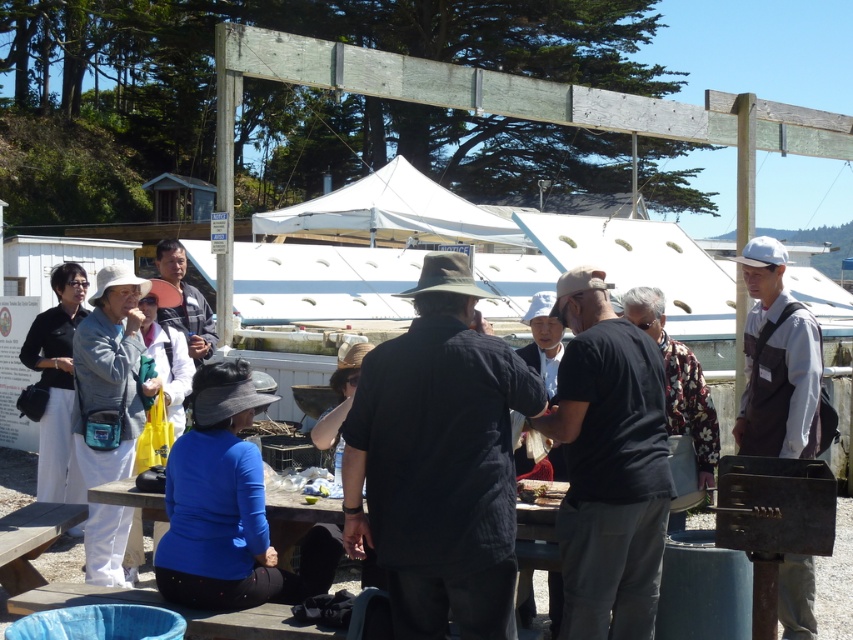
The height and width of the screenshot is (640, 853). Describe the element at coordinates (439, 460) in the screenshot. I see `dark brown fabric hat at center` at that location.

Does dark brown fabric hat at center have a greater height compared to matte black jacket at center?

Yes.

Is point (471, 340) behind point (167, 262)?

No, (471, 340) is in front of (167, 262).

Locate an element on the screen. dark brown fabric hat at center is located at coordinates (439, 460).

Does white cotton shirt at right have a lesser width compared to matte black jacket at center?

Incorrect, white cotton shirt at right's width is not less than matte black jacket at center's.

Between point (762, 296) and point (178, 320), which one is positioned in front?

Point (762, 296) is in front.

At what (x,y) coordinates should I click in order to perform the action: click on white cotton shirt at right. Please return your answer as a coordinate pair (x, y). Image resolution: width=853 pixels, height=640 pixels. Looking at the image, I should click on (776, 362).

Can you confirm if dark brown fabric hat at center is taller than white fabric canopy at center?

No, dark brown fabric hat at center is not taller than white fabric canopy at center.

The height and width of the screenshot is (640, 853). In order to click on dark brown fabric hat at center in this screenshot , I will do `click(439, 460)`.